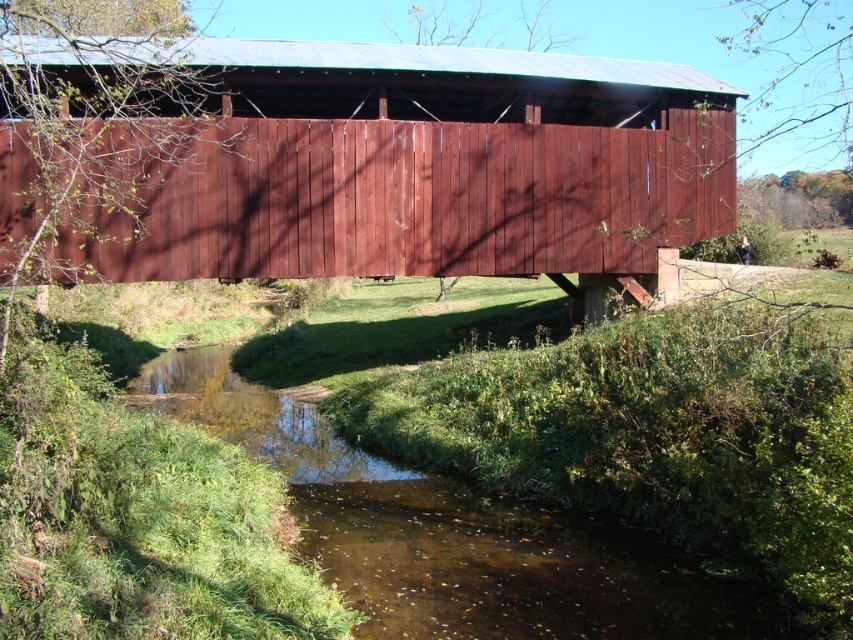
At what (x,y) coordinates should I click in order to perform the action: click on smooth wood bridge at center. Please return your answer as a coordinate pair (x, y). The height and width of the screenshot is (640, 853). Looking at the image, I should click on (363, 164).

The width and height of the screenshot is (853, 640). Describe the element at coordinates (363, 164) in the screenshot. I see `smooth wood bridge at center` at that location.

Is point (364, 168) positioned after point (572, 632)?

That is True.

Identify the location of smooth wood bridge at center. The width and height of the screenshot is (853, 640). (363, 164).